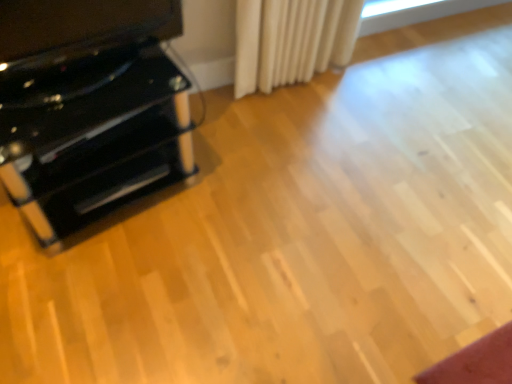
Question: From the image's perspective, is glossy black cabinet at left located above or below black glossy tv stand at left?

Choices:
 (A) above
 (B) below

Answer: (B)

Question: Looking at their shapes, would you say glossy black cabinet at left is wider or thinner than black glossy tv stand at left?

Choices:
 (A) wide
 (B) thin

Answer: (A)

Question: Which object is the farthest from the glossy black cabinet at left?

Choices:
 (A) black glossy tv stand at left
 (B) black plastic drawer at left

Answer: (A)

Question: Considering the real-world distances, which object is farthest from the black plastic drawer at left?

Choices:
 (A) black glossy tv stand at left
 (B) glossy black cabinet at left

Answer: (A)